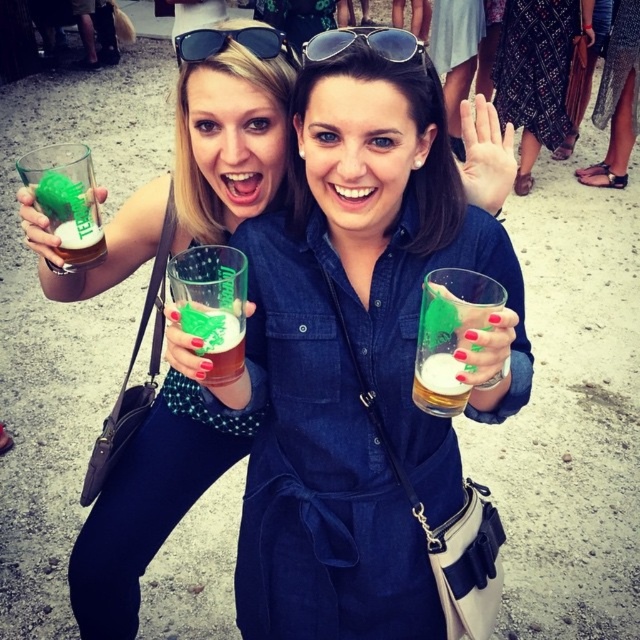
Does matte green glass at upper left have a smaller size compared to green frothy beer at center?

Incorrect, matte green glass at upper left is not smaller in size than green frothy beer at center.

Consider the image. Does matte green glass at upper left have a larger size compared to green frothy beer at center?

Yes, matte green glass at upper left is bigger than green frothy beer at center.

Is point (260, 90) in front of point (195, 321)?

No, it is not.

Identify the location of matte green glass at upper left. (192, 172).

Image resolution: width=640 pixels, height=640 pixels. What do you see at coordinates (538, 72) in the screenshot? I see `printed fabric dress at center` at bounding box center [538, 72].

What do you see at coordinates (538, 72) in the screenshot? I see `printed fabric dress at center` at bounding box center [538, 72].

Find the location of a particular element. This screenshot has width=640, height=640. printed fabric dress at center is located at coordinates (538, 72).

Is satin black dress at lower right thinner than black reflective sunglasses at upper center?

In fact, satin black dress at lower right might be wider than black reflective sunglasses at upper center.

Which is in front, point (621, 138) or point (196, 35)?

Point (196, 35)

This screenshot has width=640, height=640. I want to click on satin black dress at lower right, so click(x=618, y=99).